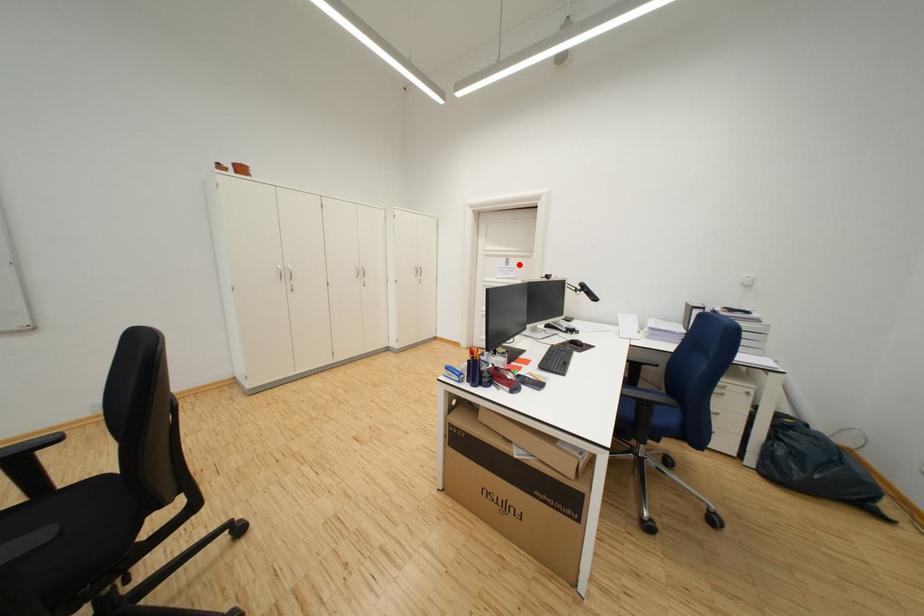
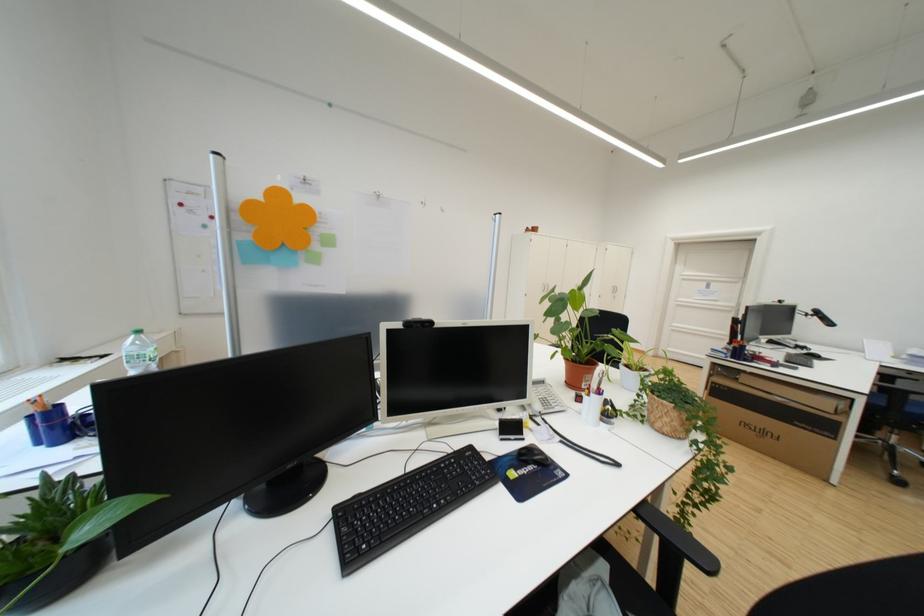
Find the pixel in the second image that matches the highlighted location in the first image.

(720, 288)